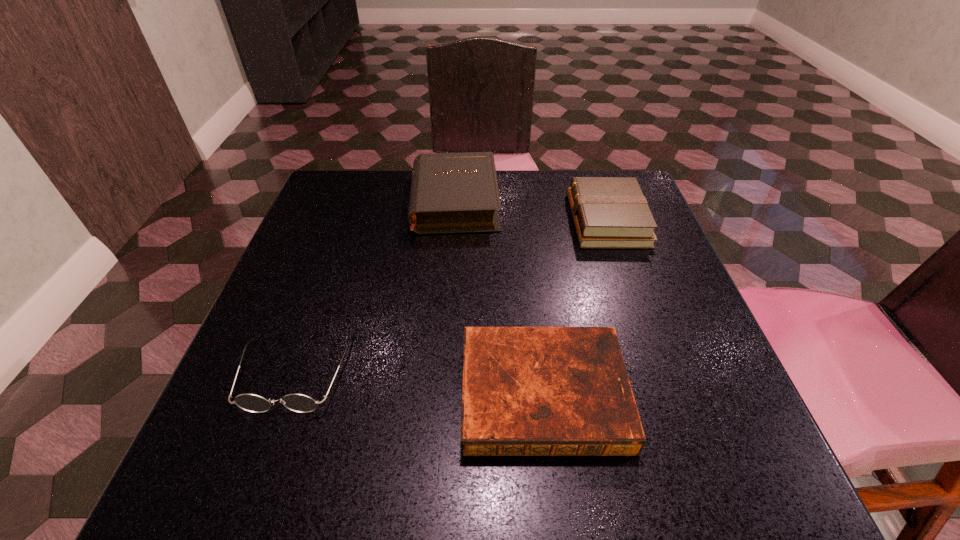
Find the location of `free space at the right edge of the desktop`. free space at the right edge of the desktop is located at coordinates (659, 256).

Find the location of a particular element. vacant space at the far left corner is located at coordinates (328, 187).

Where is `free region at the near left corner of the desktop`? The image size is (960, 540). free region at the near left corner of the desktop is located at coordinates (263, 460).

Identify the location of free space at the near right corner. This screenshot has width=960, height=540. (732, 457).

Locate an element on the screen. This screenshot has height=540, width=960. vacant area that lies between the leftmost object and the shortest Bible is located at coordinates (420, 382).

Image resolution: width=960 pixels, height=540 pixels. I want to click on vacant point located between the leftmost object and the shortest Bible, so click(x=420, y=382).

Identify which object is the nearest to the leftmost object. Please provide its 2D coordinates. Your answer should be formatted as a tuple, i.e. [(x, y)], where the tuple contains the x and y coordinates of a point satisfying the conditions above.

[(527, 391)]

You are a GUI agent. You are given a task and a screenshot of the screen. Output one action in this format:
    pyautogui.click(x=<x>, y=<y>)
    Task: Click on the closest object to the shortest Bible
    
    Given the screenshot: What is the action you would take?
    pyautogui.click(x=300, y=403)

The width and height of the screenshot is (960, 540). Identify the location of the third closest Bible to the leftmost object. (608, 212).

Select which Bible appears as the closest to the shortest object. Please provide its 2D coordinates. Your answer should be formatted as a tuple, i.e. [(x, y)], where the tuple contains the x and y coordinates of a point satisfying the conditions above.

[(608, 212)]